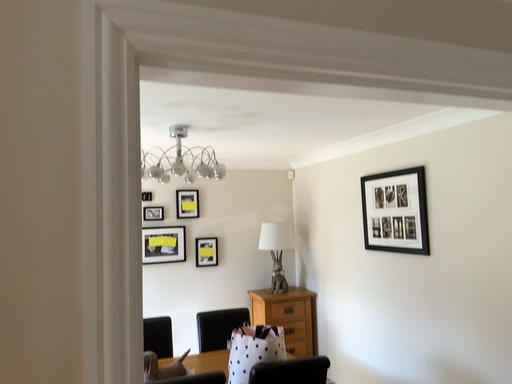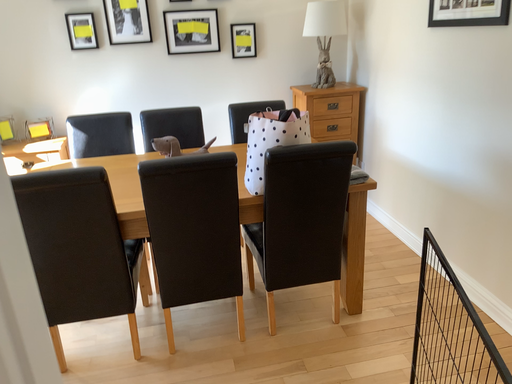
Question: How did the camera likely rotate when shooting the video?

Choices:
 (A) rotated upward
 (B) rotated downward

Answer: (B)